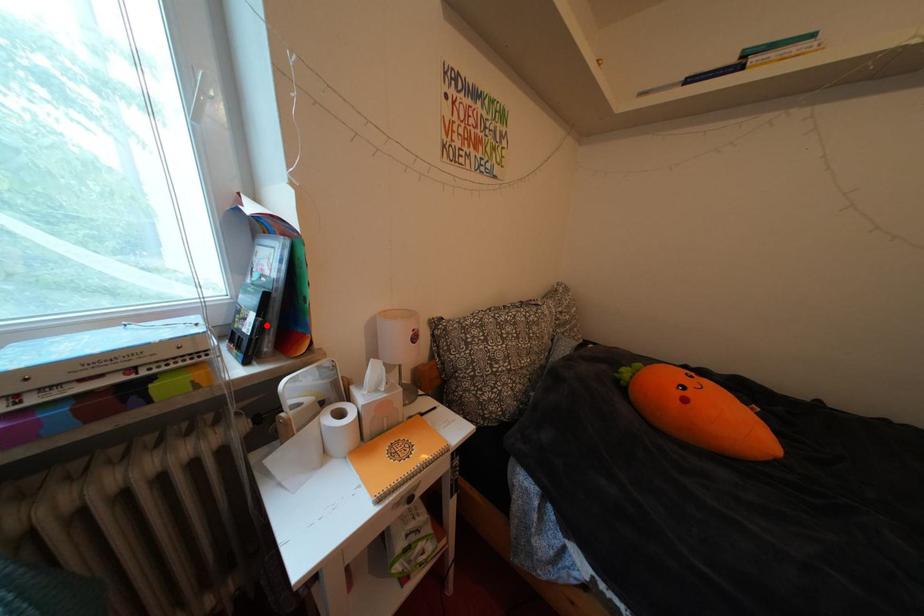
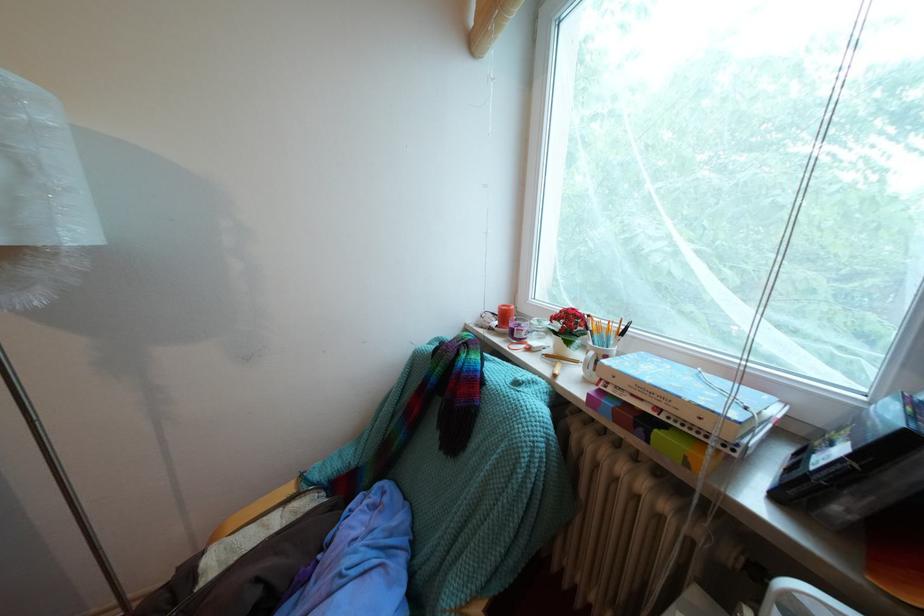
In the second image, find the point that corresponds to the highlighted location in the first image.

(853, 466)